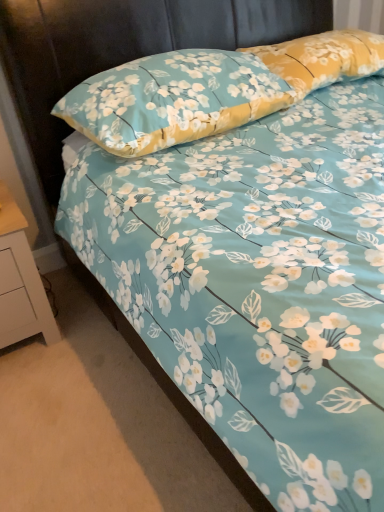
This screenshot has width=384, height=512. Find the location of `space that is in front of white painted wood nightstand at lower left`. space that is in front of white painted wood nightstand at lower left is located at coordinates (43, 386).